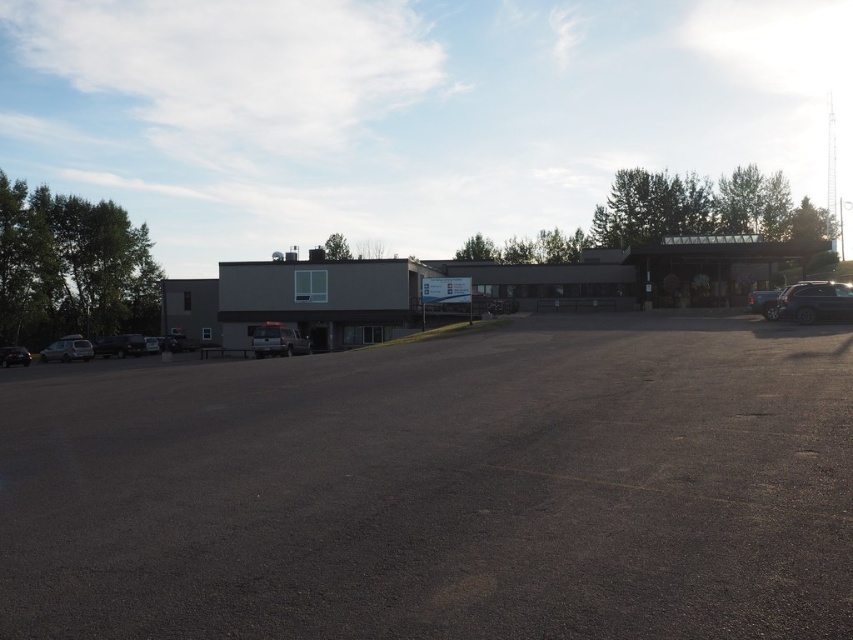
Is dark asphalt parking lot at center taller than shiny black sedan at lower left?

Yes, dark asphalt parking lot at center is taller than shiny black sedan at lower left.

Does point (358, 486) come closer to viewer compared to point (15, 355)?

That is True.

Where is `dark asphalt parking lot at center`? The height and width of the screenshot is (640, 853). dark asphalt parking lot at center is located at coordinates (440, 490).

Measure the distance between satin black suv at right and camera.

94.06 feet

Which is below, satin black suv at right or matte silver suv at left?

matte silver suv at left is below.

Which is behind, point (817, 292) or point (102, 344)?

Positioned behind is point (102, 344).

This screenshot has width=853, height=640. I want to click on satin black suv at right, so click(x=815, y=301).

Is satin black suv at right positioned at the back of metallic silver van at center?

No, satin black suv at right is closer to the viewer.

Is point (815, 308) farther from camera compared to point (273, 342)?

No, it is not.

At what (x,y) coordinates should I click in order to perform the action: click on satin black suv at right. Please return your answer as a coordinate pair (x, y). Looking at the image, I should click on (815, 301).